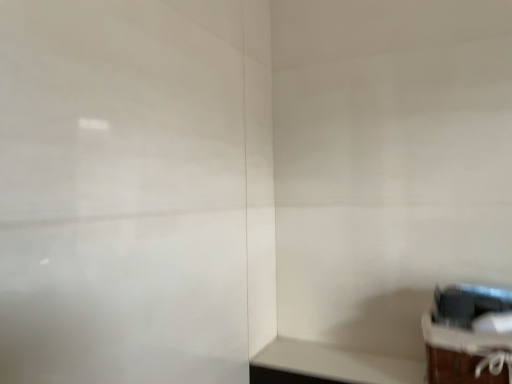
Measure the distance between point (438, 379) and camera.

28.66 inches.

This screenshot has height=384, width=512. Describe the element at coordinates (465, 354) in the screenshot. I see `wooden crate at lower right` at that location.

Where is `wooden crate at lower right`? The width and height of the screenshot is (512, 384). wooden crate at lower right is located at coordinates (465, 354).

Image resolution: width=512 pixels, height=384 pixels. What do you see at coordinates (329, 365) in the screenshot?
I see `white matte table at lower right` at bounding box center [329, 365].

Measure the distance between point (423,382) and camera.

A distance of 78.40 centimeters exists between point (423,382) and camera.

This screenshot has height=384, width=512. I want to click on white matte table at lower right, so click(329, 365).

Locate an element on the screen. The height and width of the screenshot is (384, 512). wooden crate at lower right is located at coordinates click(465, 354).

Considering the relative positions of white matte table at lower right and wooden crate at lower right in the image provided, is white matte table at lower right to the right of wooden crate at lower right from the viewer's perspective?

Incorrect, white matte table at lower right is not on the right side of wooden crate at lower right.

In the image, is white matte table at lower right positioned in front of or behind wooden crate at lower right?

white matte table at lower right is behind wooden crate at lower right.

Which is further, (329, 355) or (444, 372)?

The point (329, 355) is more distant.

From the image's perspective, which object appears higher, white matte table at lower right or wooden crate at lower right?

wooden crate at lower right, from the image's perspective.

From a real-world perspective, which object rests below the other?

white matte table at lower right, from a real-world perspective.

Is white matte table at lower right wider than wooden crate at lower right?

Incorrect, the width of white matte table at lower right does not surpass that of wooden crate at lower right.

In terms of height, does white matte table at lower right look taller or shorter compared to wooden crate at lower right?

Clearly, white matte table at lower right is shorter compared to wooden crate at lower right.

Looking at the image, does white matte table at lower right seem bigger or smaller compared to wooden crate at lower right?

Considering their sizes, white matte table at lower right takes up less space than wooden crate at lower right.

Is white matte table at lower right completely or partially outside of wooden crate at lower right?

Yes.

Is white matte table at lower right not near wooden crate at lower right?

They are positioned close to each other.

Is white matte table at lower right looking in the opposite direction of wooden crate at lower right?

No.

Can you tell me how much white matte table at lower right and wooden crate at lower right differ in facing direction?

The angular difference between white matte table at lower right and wooden crate at lower right is 0.0779 degrees.

Where is `furniture above the white matte table at lower right (from a real-world perspective)`? The height and width of the screenshot is (384, 512). furniture above the white matte table at lower right (from a real-world perspective) is located at coordinates (465, 354).

Which object is positioned more to the left, wooden crate at lower right or white matte table at lower right?

white matte table at lower right is more to the left.

Which object is more forward, wooden crate at lower right or white matte table at lower right?

wooden crate at lower right is more forward.

Between point (449, 377) and point (404, 373), which one is positioned behind?

The point (404, 373) is more distant.

From the image's perspective, is wooden crate at lower right on top of white matte table at lower right?

Yes.

From a real-world perspective, which is physically above, wooden crate at lower right or white matte table at lower right?

In real-world perspective, wooden crate at lower right is above.

Considering the relative sizes of wooden crate at lower right and white matte table at lower right in the image provided, is wooden crate at lower right thinner than white matte table at lower right?

Incorrect, the width of wooden crate at lower right is not less than that of white matte table at lower right.

Is wooden crate at lower right shorter than white matte table at lower right?

No.

Considering the relative sizes of wooden crate at lower right and white matte table at lower right in the image provided, is wooden crate at lower right smaller than white matte table at lower right?

A: Incorrect, wooden crate at lower right is not smaller in size than white matte table at lower right.

Can we say wooden crate at lower right lies outside white matte table at lower right?

Yes, wooden crate at lower right is outside of white matte table at lower right.

Is wooden crate at lower right touching white matte table at lower right?

No, wooden crate at lower right is not with white matte table at lower right.

Is wooden crate at lower right facing towards white matte table at lower right?

No, wooden crate at lower right is not aimed at white matte table at lower right.

How much distance is there between wooden crate at lower right and white matte table at lower right?

The distance of wooden crate at lower right from white matte table at lower right is 7.23 inches.

You are a GUI agent. You are given a task and a screenshot of the screen. Output one action in this format:
    pyautogui.click(x=<x>, y=<y>)
    Task: Click on the furniture located above the white matte table at lower right (from the image's perspective)
    
    Given the screenshot: What is the action you would take?
    pyautogui.click(x=465, y=354)

This screenshot has height=384, width=512. In order to click on table below the wooden crate at lower right (from the image's perspective) in this screenshot , I will do `click(329, 365)`.

Identify the location of furniture in front of the white matte table at lower right. tap(465, 354).